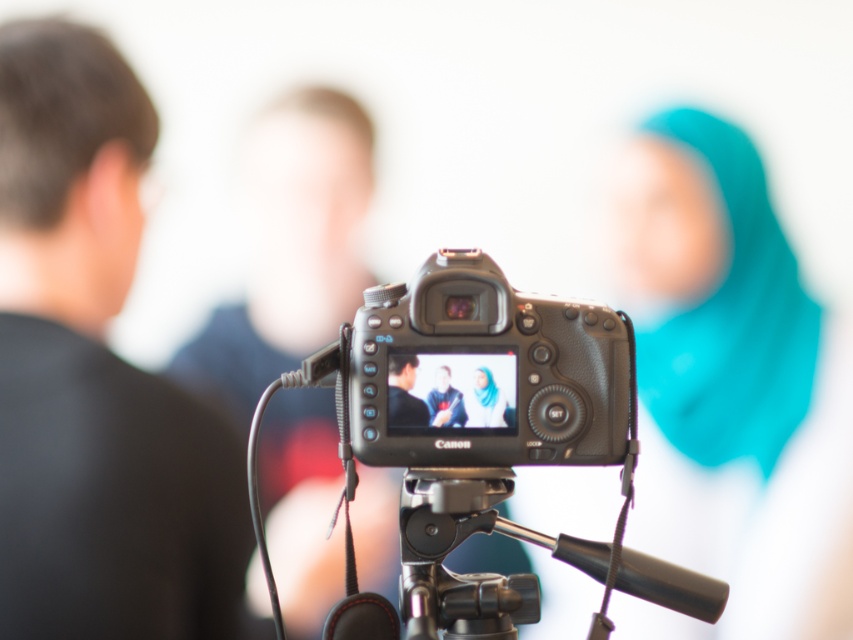
Which is above, black plastic tripod at center or blue fabric hijab at center?

blue fabric hijab at center is above.

Can you confirm if black plastic tripod at center is wider than blue fabric hijab at center?

Yes.

Where is `black plastic tripod at center`? black plastic tripod at center is located at coordinates (496, 573).

Does black matte shirt at left have a larger size compared to black textured camera at center?

Correct, black matte shirt at left is larger in size than black textured camera at center.

This screenshot has width=853, height=640. Describe the element at coordinates (96, 374) in the screenshot. I see `black matte shirt at left` at that location.

Which is in front, point (202, 593) or point (596, 374)?

Point (596, 374) is in front.

Locate an element on the screen. black matte shirt at left is located at coordinates (96, 374).

Which is in front, point (15, 387) or point (468, 412)?

Point (468, 412) is more forward.

Based on the photo, who is more distant from viewer, (x=184, y=515) or (x=495, y=406)?

The point (x=184, y=515) is more distant.

In order to click on black matte shirt at left in this screenshot , I will do `click(96, 374)`.

You are a GUI agent. You are given a task and a screenshot of the screen. Output one action in this format:
    pyautogui.click(x=<x>, y=<y>)
    Task: Click on the black matte shirt at left
    
    Given the screenshot: What is the action you would take?
    pyautogui.click(x=96, y=374)